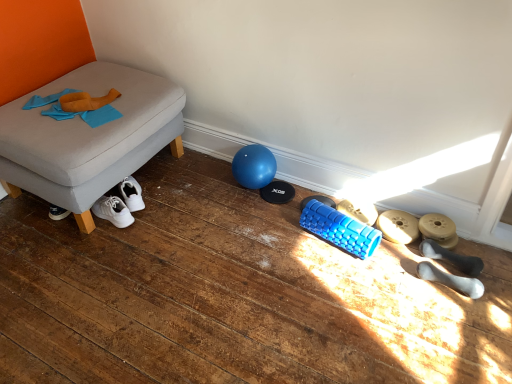
The image size is (512, 384). In order to click on vacant area that is situated to the right of gray fabric ottoman at left in this screenshot , I will do `click(216, 210)`.